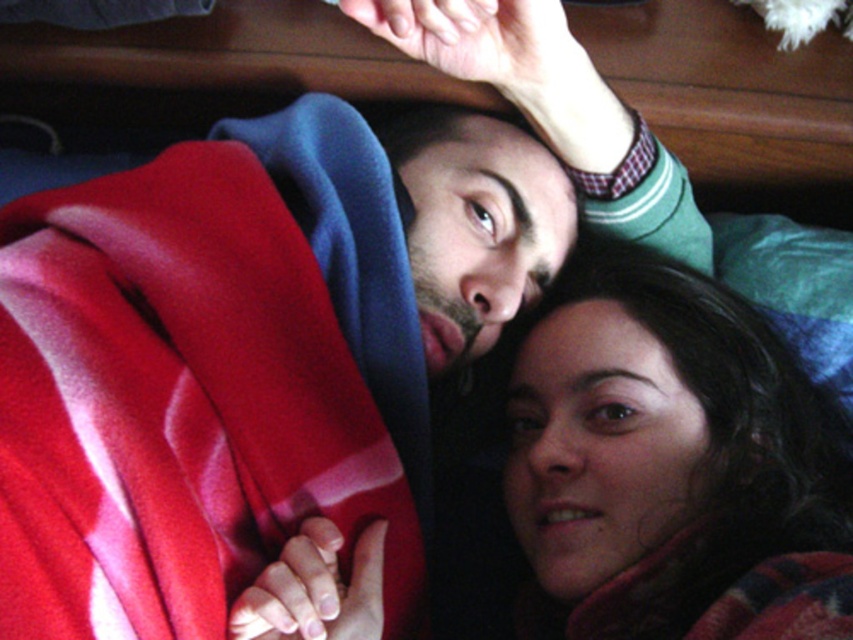
Question: Among these objects, which one is nearest to the camera?

Choices:
 (A) velvety red blanket at upper left
 (B) smooth skin face at center

Answer: (A)

Question: In this image, where is velvety red blanket at upper left located relative to smooth skin face at center?

Choices:
 (A) above
 (B) below

Answer: (A)

Question: Is velvety red blanket at upper left smaller than smooth skin face at center?

Choices:
 (A) yes
 (B) no

Answer: (A)

Question: In this image, where is velvety red blanket at upper left located relative to smooth skin face at center?

Choices:
 (A) right
 (B) left

Answer: (B)